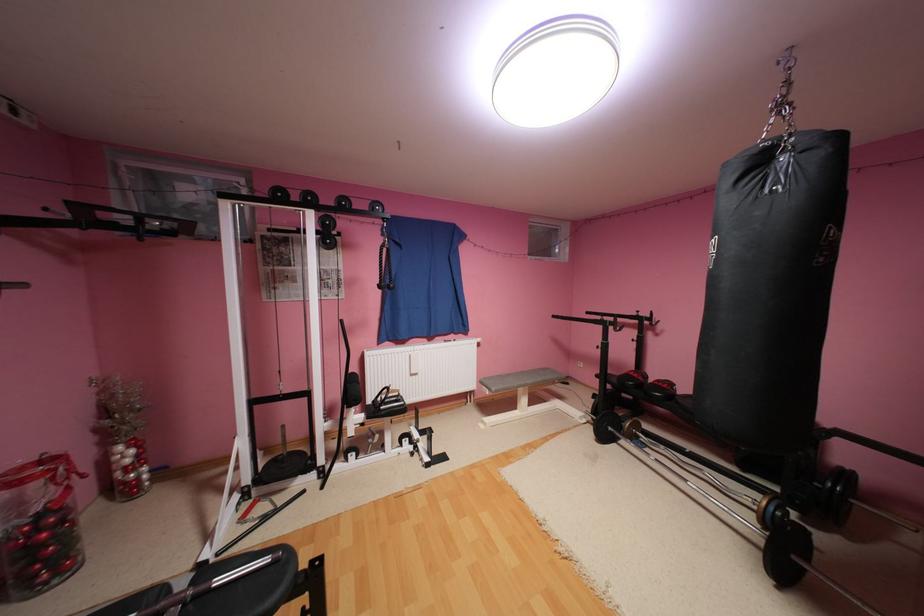
Identify the location of black row handle. The height and width of the screenshot is (616, 924). (234, 588).